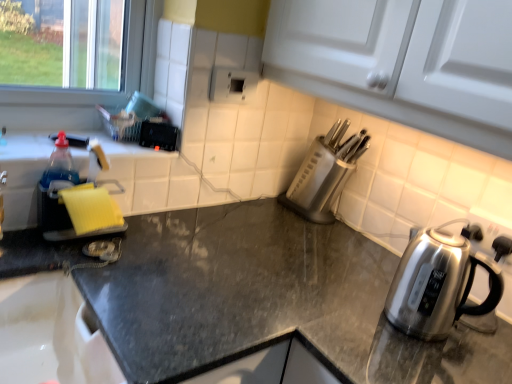
Image resolution: width=512 pixels, height=384 pixels. I want to click on vacant area that is in front of satin silver knife block at center-right, so click(x=305, y=236).